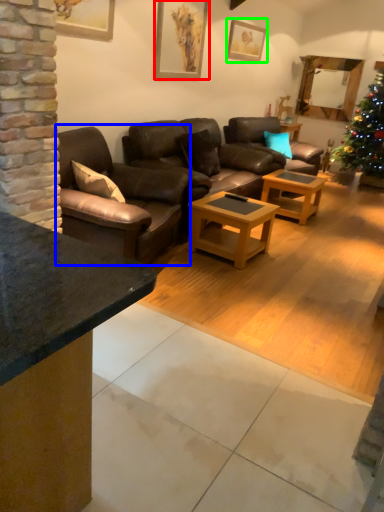
Question: Based on their relative distances, which object is nearer to picture frame (highlighted by a red box)? Choose from studio couch (highlighted by a blue box) and picture frame (highlighted by a green box).

Choices:
 (A) studio couch
 (B) picture frame

Answer: (B)